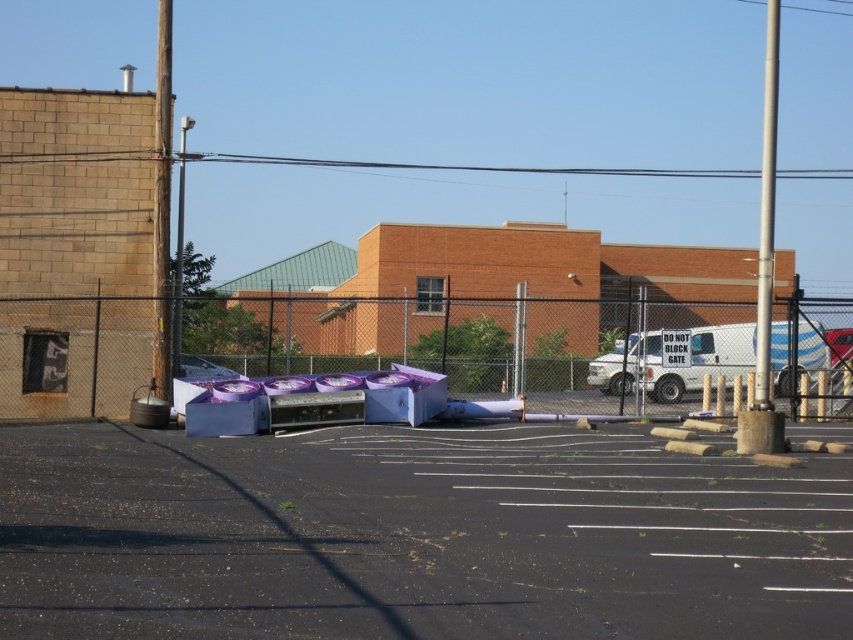
Question: Among these points, which one is nearest to the camera?

Choices:
 (A) (561, 548)
 (B) (819, 355)

Answer: (A)

Question: Does black asphalt parking lot at center come in front of white van at center?

Choices:
 (A) yes
 (B) no

Answer: (A)

Question: Which of the following is the closest to the observer?

Choices:
 (A) metallic chain-link fence at center
 (B) white van at center

Answer: (A)

Question: Which object is closer to the camera taking this photo?

Choices:
 (A) black asphalt parking lot at center
 (B) metallic chain-link fence at center
 (C) white van at center

Answer: (A)

Question: Observing the image, what is the correct spatial positioning of black asphalt parking lot at center in reference to white van at center?

Choices:
 (A) left
 (B) right

Answer: (A)

Question: Does black asphalt parking lot at center appear under white van at center?

Choices:
 (A) yes
 (B) no

Answer: (A)